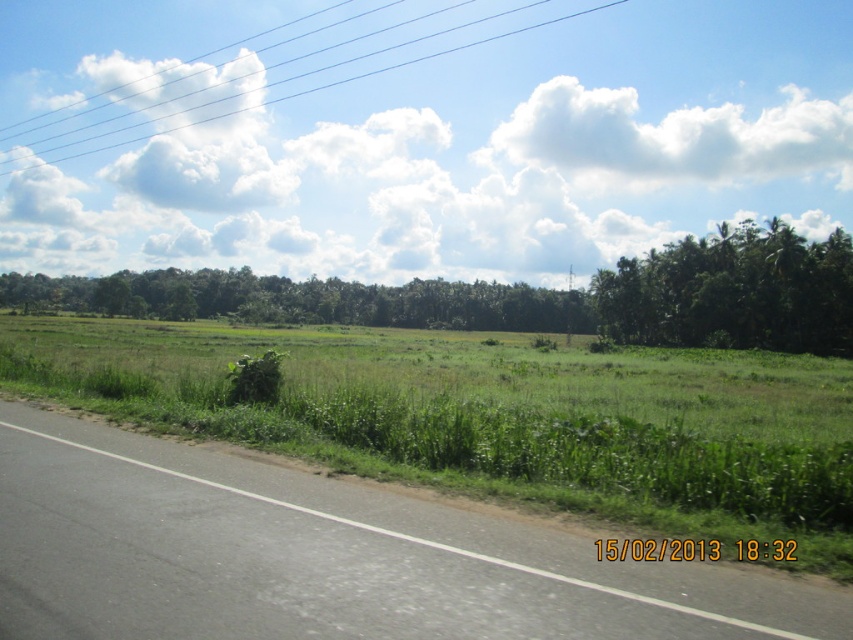
Question: Which object is farther from the camera taking this photo?

Choices:
 (A) white wire at upper center
 (B) black asphalt road at lower left
 (C) green leafy trees at right

Answer: (A)

Question: Is green leafy trees at center further to the viewer compared to white wire at upper center?

Choices:
 (A) no
 (B) yes

Answer: (A)

Question: Is green leafy trees at right bigger than green leafy trees at center?

Choices:
 (A) no
 (B) yes

Answer: (A)

Question: Considering the relative positions of black asphalt road at lower left and white wire at upper center in the image provided, where is black asphalt road at lower left located with respect to white wire at upper center?

Choices:
 (A) right
 (B) left

Answer: (A)

Question: Which object is the closest to the green leafy trees at right?

Choices:
 (A) black asphalt road at lower left
 (B) white wire at upper center
 (C) green leafy trees at center

Answer: (C)

Question: Which is nearer to the green leafy trees at center?

Choices:
 (A) white wire at upper center
 (B) black asphalt road at lower left
 (C) green leafy trees at right

Answer: (C)